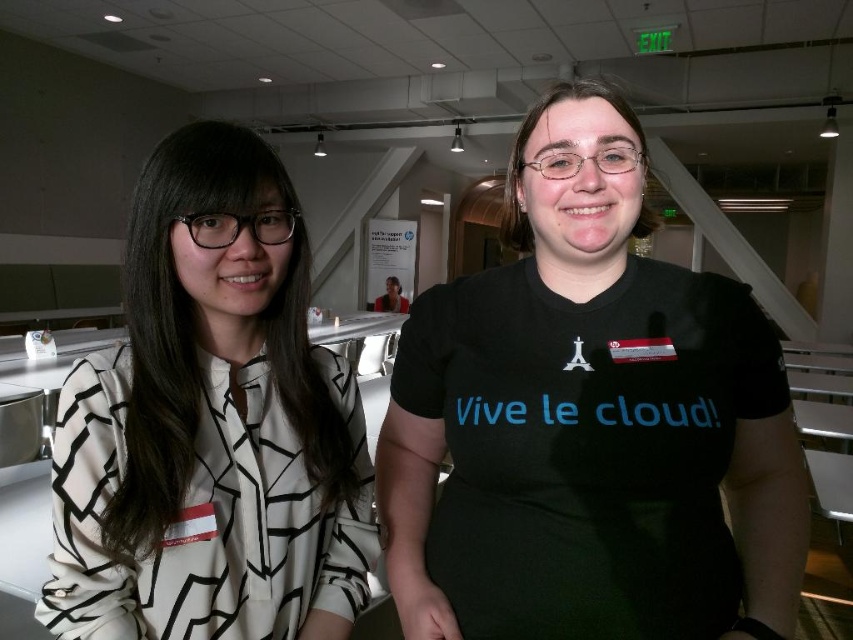
Can you confirm if black matte t-shirt at center is wider than white printed blouse at left?

Yes, black matte t-shirt at center is wider than white printed blouse at left.

Which of these two, black matte t-shirt at center or white printed blouse at left, stands shorter?

white printed blouse at left

I want to click on black matte t-shirt at center, so click(x=589, y=422).

At what (x,y) coordinates should I click in order to perform the action: click on black matte t-shirt at center. Please return your answer as a coordinate pair (x, y). The width and height of the screenshot is (853, 640). Looking at the image, I should click on (589, 422).